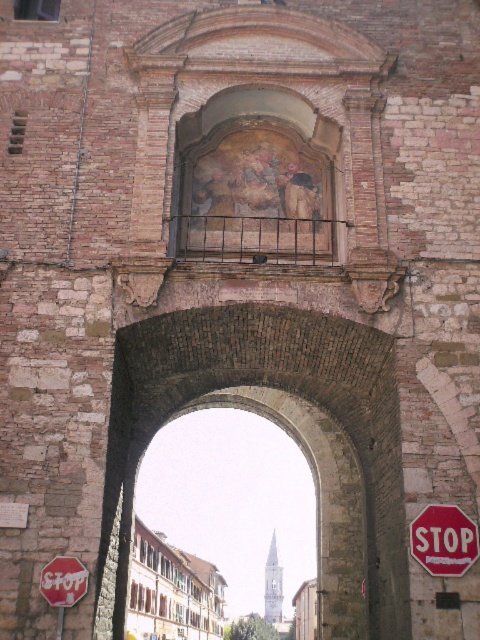
Question: Among these points, which one is farthest from the camera?

Choices:
 (A) (288, 236)
 (B) (52, 580)

Answer: (A)

Question: Does rusty metal balcony at upper center have a lesser width compared to red matte stop sign at center?

Choices:
 (A) no
 (B) yes

Answer: (A)

Question: Does stone archway at center appear over red matte stop sign at center?

Choices:
 (A) no
 (B) yes

Answer: (B)

Question: Which point is closer to the camera?

Choices:
 (A) rusty metal balcony at upper center
 (B) red matte stop sign at lower left
 (C) red matte stop sign at center

Answer: (B)

Question: Can you confirm if stone archway at center is wider than red matte stop sign at center?

Choices:
 (A) no
 (B) yes

Answer: (B)

Question: Which point appears farthest from the camera in this image?

Choices:
 (A) (269, 227)
 (B) (62, 557)

Answer: (A)